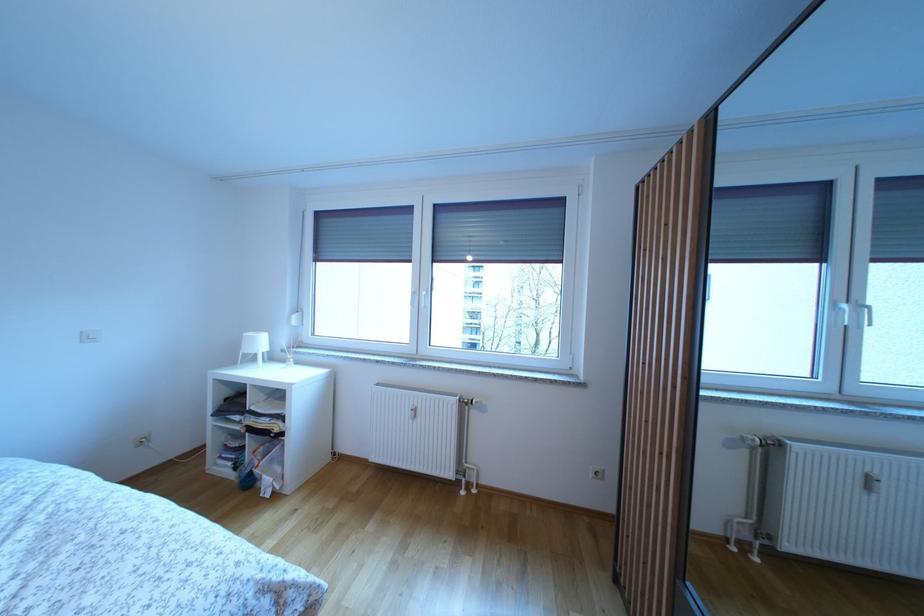
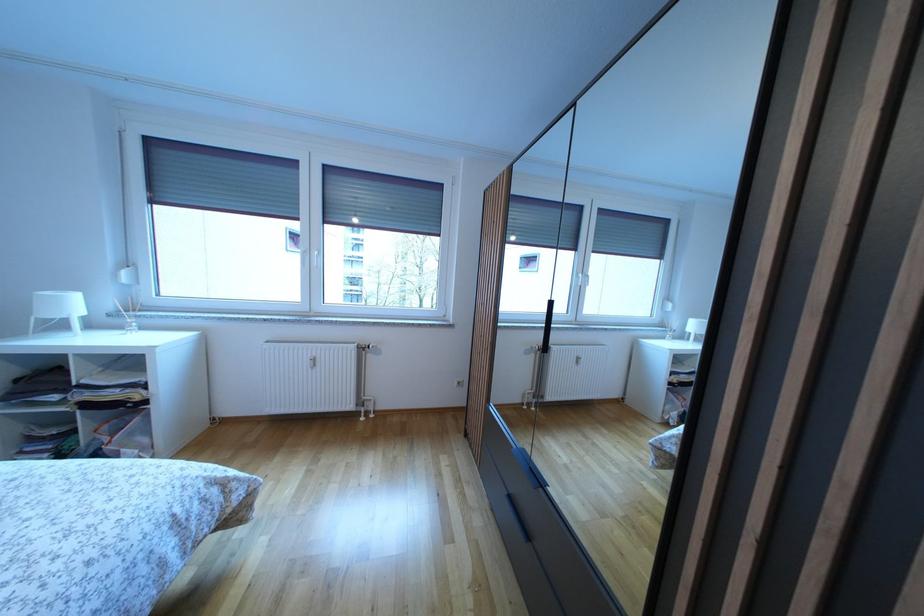
Locate, in the second image, the point that corresponds to [416,419] in the first image.

(314, 370)